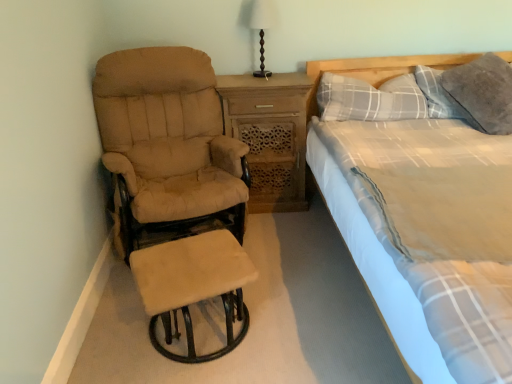
You are a GUI agent. You are given a task and a screenshot of the screen. Output one action in this format:
    pyautogui.click(x=<x>, y=<y>)
    Task: Click on the vacant area that lies to the right of beige fabric recliner at left
    
    Given the screenshot: What is the action you would take?
    pyautogui.click(x=297, y=254)